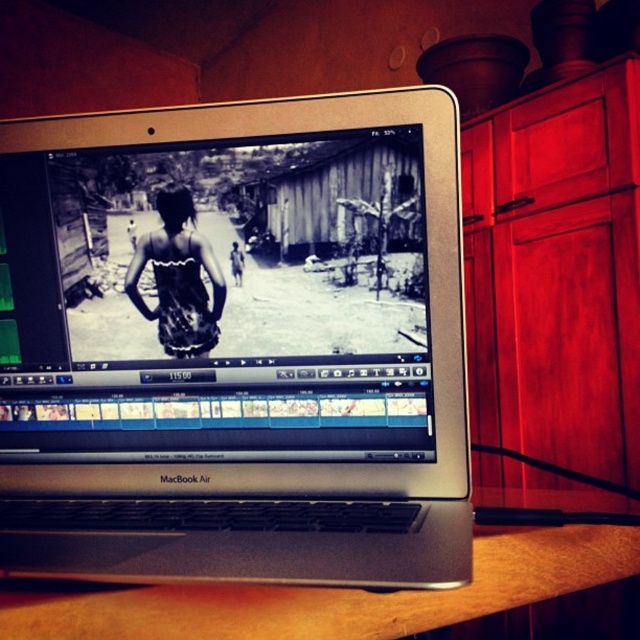
Does wooden table at lower center have a larger size compared to black textured dress at center?

Yes, wooden table at lower center is bigger than black textured dress at center.

Which is more to the left, wooden table at lower center or black textured dress at center?

black textured dress at center

Does point (136, 627) come closer to viewer compared to point (172, 316)?

Yes, point (136, 627) is closer to viewer.

Locate an element on the screen. The width and height of the screenshot is (640, 640). wooden table at lower center is located at coordinates (332, 595).

Does point (77, 413) come farther from viewer compared to point (132, 280)?

Yes.

Between silver metallic laptop at center and black textured dress at center, which one is positioned higher?

black textured dress at center is above.

The height and width of the screenshot is (640, 640). What are the coordinates of `silver metallic laptop at center` in the screenshot? It's located at (236, 342).

Who is positioned more to the right, silver metallic laptop at center or wooden table at lower center?

wooden table at lower center is more to the right.

Does silver metallic laptop at center have a lesser height compared to wooden table at lower center?

No.

What do you see at coordinates (236, 342) in the screenshot? I see `silver metallic laptop at center` at bounding box center [236, 342].

Find the location of a particular element. silver metallic laptop at center is located at coordinates (236, 342).